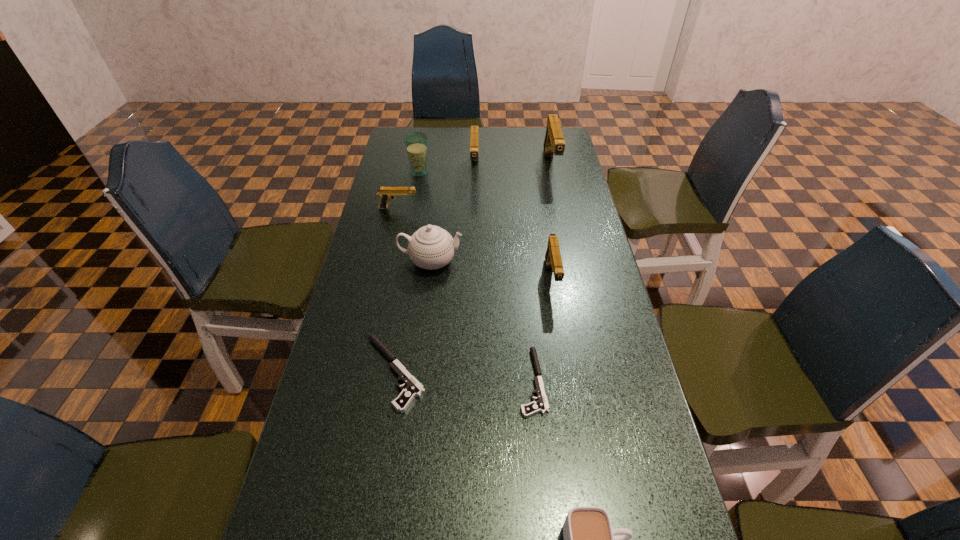
Locate an element on the screen. This screenshot has height=540, width=960. the tallest pistol is located at coordinates (554, 144).

Identify the location of the biggest tan pistol. click(554, 144).

Image resolution: width=960 pixels, height=540 pixels. What are the coordinates of `glass` in the screenshot? It's located at (416, 143).

In order to click on the second tallest pistol in this screenshot , I will do `click(474, 136)`.

You are a GUI agent. You are given a task and a screenshot of the screen. Output one action in this format:
    pyautogui.click(x=<x>, y=<y>)
    Task: Click on the third smallest tan pistol
    
    Given the screenshot: What is the action you would take?
    pyautogui.click(x=474, y=136)

Where is `chinaware`? This screenshot has height=540, width=960. chinaware is located at coordinates (431, 247).

Identify the location of the nearest tan pistol. The width and height of the screenshot is (960, 540). (553, 259).

I want to click on the third biggest tan pistol, so click(x=553, y=259).

The image size is (960, 540). Identify the location of the third farthest pistol. (386, 194).

You are a GUI agent. You are given a task and a screenshot of the screen. Output one action in this format:
    pyautogui.click(x=<x>, y=<y>)
    Task: Click on the fourth farthest object
    Image resolution: width=960 pixels, height=540 pixels.
    Given the screenshot: What is the action you would take?
    pyautogui.click(x=386, y=194)